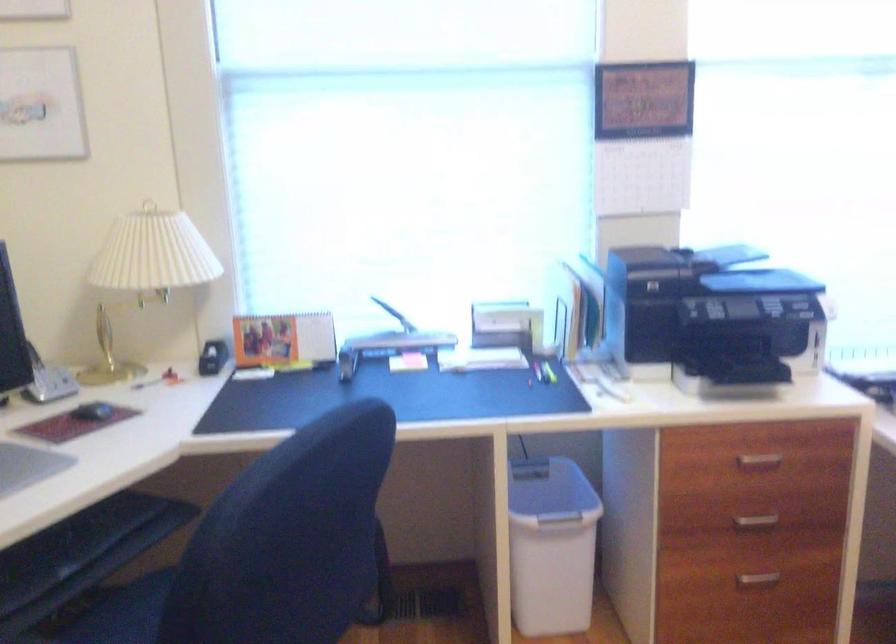
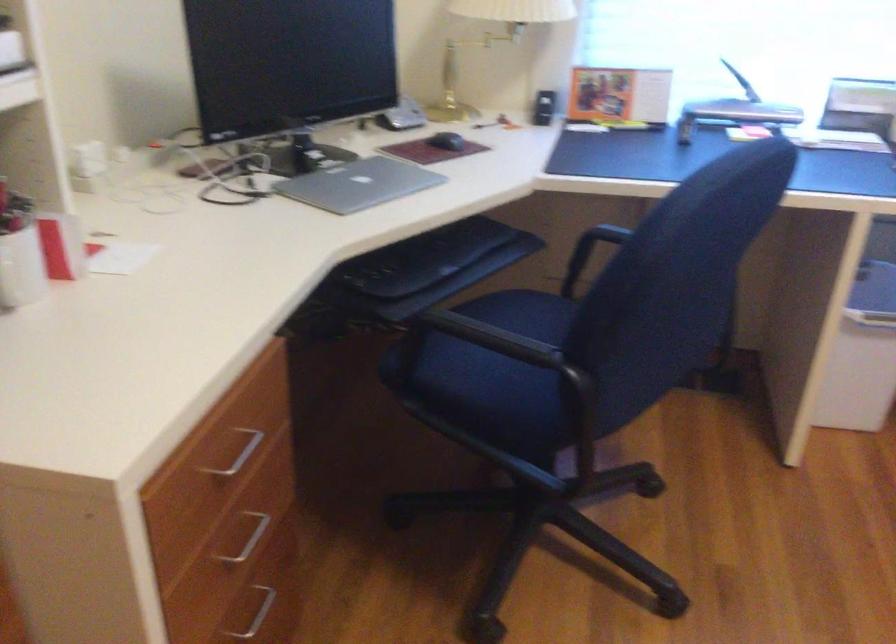
The point at (89, 418) is marked in the first image. Where is the corresponding point in the second image?

(446, 140)